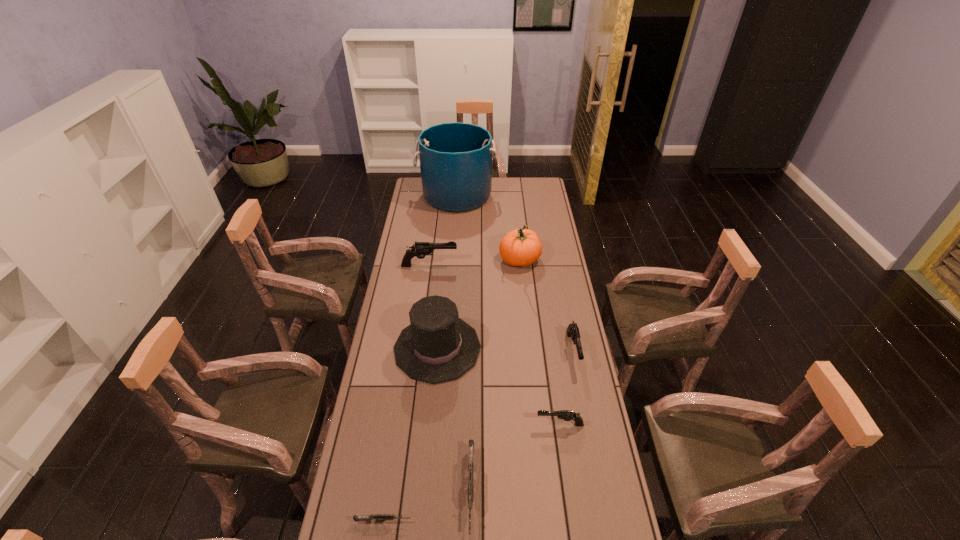
Where is `vacant space located at the end of the barrel of the third farthest gun`? This screenshot has width=960, height=540. vacant space located at the end of the barrel of the third farthest gun is located at coordinates (483, 424).

The height and width of the screenshot is (540, 960). Identify the location of vacant position located at the end of the barrel of the third farthest gun. (504, 424).

This screenshot has height=540, width=960. In order to click on vacant space located 0.190m aimed along the barrel of the shortest object in this screenshot , I will do `click(477, 522)`.

Identify the location of object located at the far edge. The height and width of the screenshot is (540, 960). (455, 158).

Identify the location of bucket at the left edge. (455, 158).

Find the location of `dress hat that is at the left edge`. dress hat that is at the left edge is located at coordinates (438, 346).

This screenshot has height=540, width=960. I want to click on pumpkin that is at the right edge, so click(x=520, y=247).

At what (x,y) coordinates should I click in order to perform the action: click on object situated at the far left corner. Please return your answer as a coordinate pair (x, y). The height and width of the screenshot is (540, 960). Looking at the image, I should click on (455, 158).

This screenshot has width=960, height=540. What are the coordinates of `vacant region at the left edge of the desktop` in the screenshot? It's located at (416, 230).

Locate an element on the screen. vacant area at the right edge is located at coordinates pos(524,200).